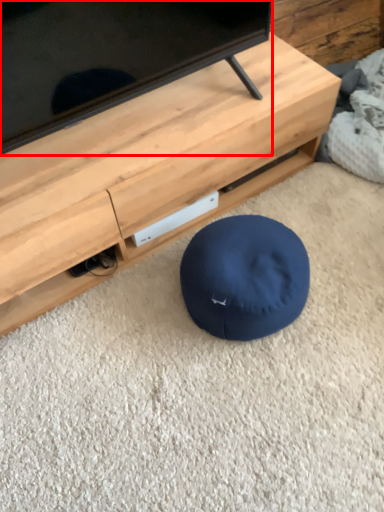
Question: From the image, what is the correct spatial relationship of television (annotated by the red box) in relation to furniture?

Choices:
 (A) left
 (B) right

Answer: (A)